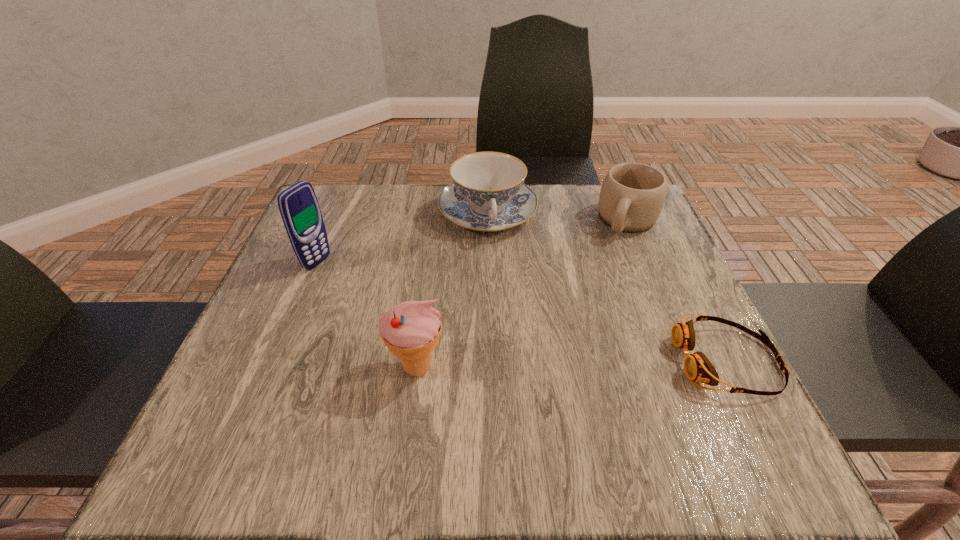
I want to click on icecream, so click(411, 330).

The image size is (960, 540). I want to click on goggles, so click(x=697, y=367).

Where is `cellular telephone`? cellular telephone is located at coordinates (298, 205).

What are the coordinates of `the third farthest object` in the screenshot? It's located at (298, 205).

Identify the location of mug. The image size is (960, 540). (632, 195).

At what (x,y) coordinates should I click in order to perform the action: click on chinaware. Please return your answer as a coordinate pair (x, y). This screenshot has width=960, height=540. Looking at the image, I should click on (488, 193).

You are a GUI agent. You are given a task and a screenshot of the screen. Output one action in this format:
    pyautogui.click(x=<x>, y=<y>)
    Task: Click on the vacant space positioned 0.140m on the back of the icecream
    The image size is (960, 540).
    Given the screenshot: What is the action you would take?
    [426, 293]

Where is `free space located with the lenses facing forward on the goggles`? Image resolution: width=960 pixels, height=540 pixels. free space located with the lenses facing forward on the goggles is located at coordinates (486, 361).

Find the location of a particular element. vacant space positioned with the lenses facing forward on the goggles is located at coordinates (530, 361).

Locate an element on the screen. This screenshot has width=960, height=540. vacant area located 0.190m with the lenses facing forward on the goggles is located at coordinates (574, 361).